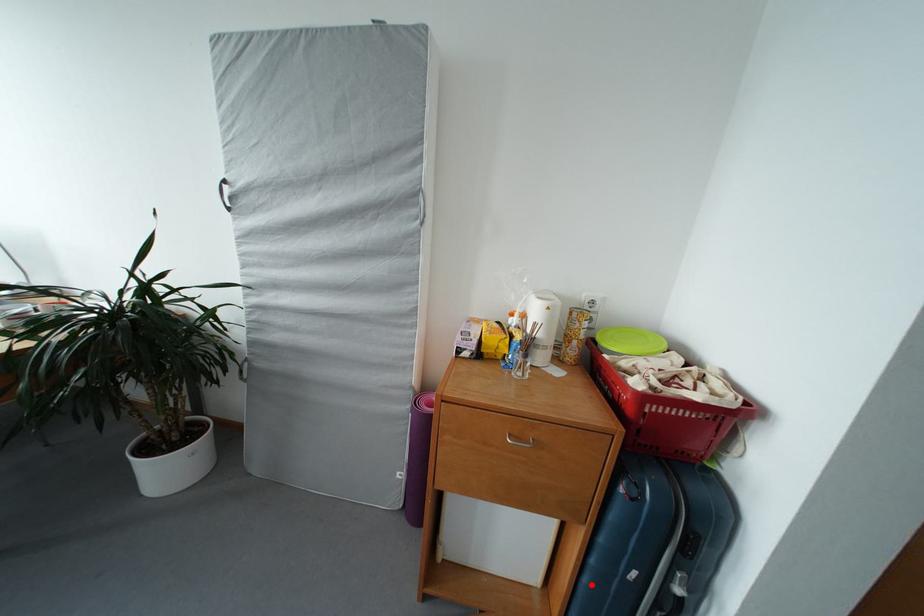
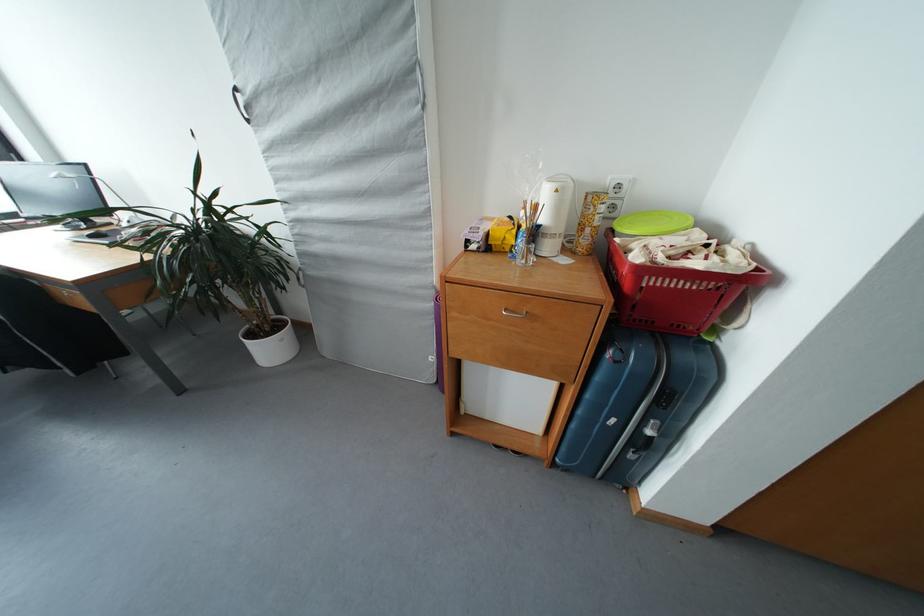
The point at the highlighted location is marked in the first image. Where is the corresponding point in the second image?

(579, 431)